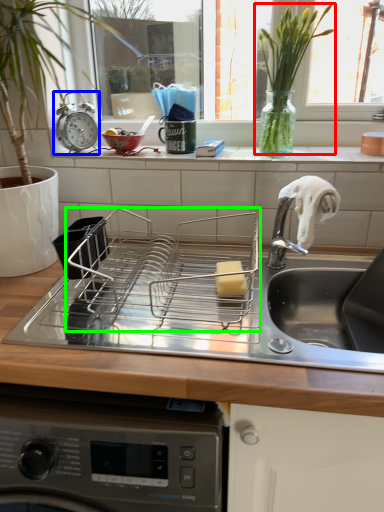
Question: Which object is positioned farthest from plant (highlighted by a red box)? Select from alarm clock (highlighted by a blue box) and appliance (highlighted by a green box).

Choices:
 (A) alarm clock
 (B) appliance

Answer: (A)